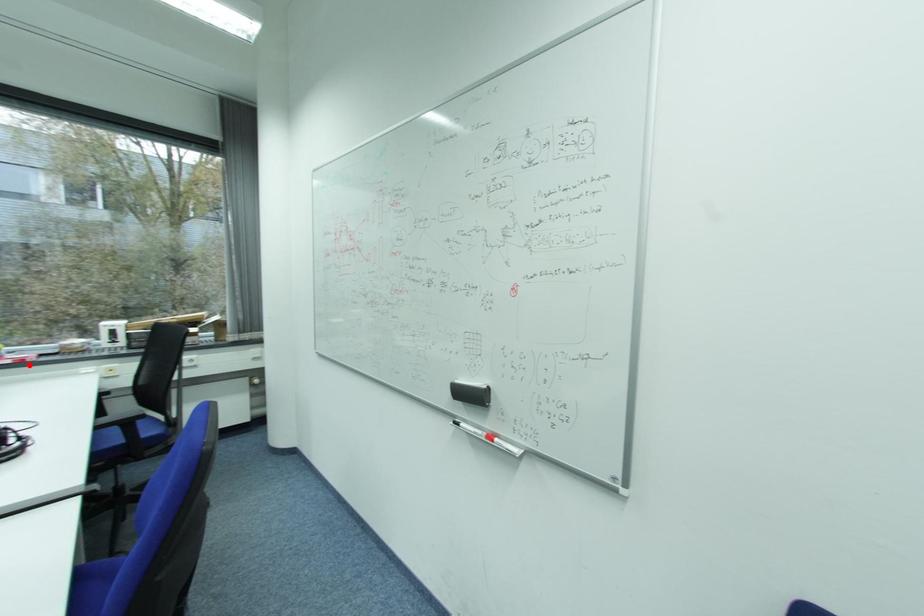
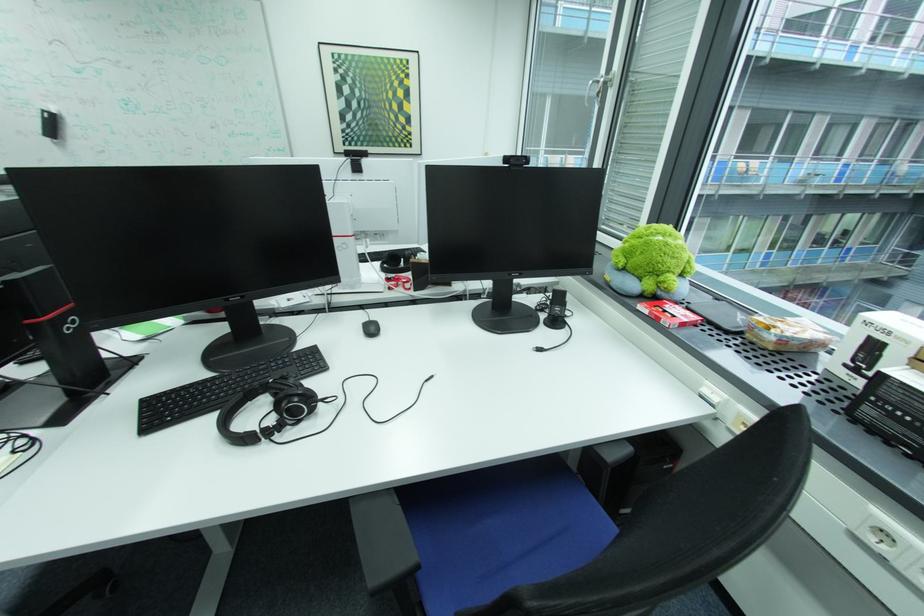
The point at the highlighted location is marked in the first image. Where is the corresponding point in the second image?

(662, 322)